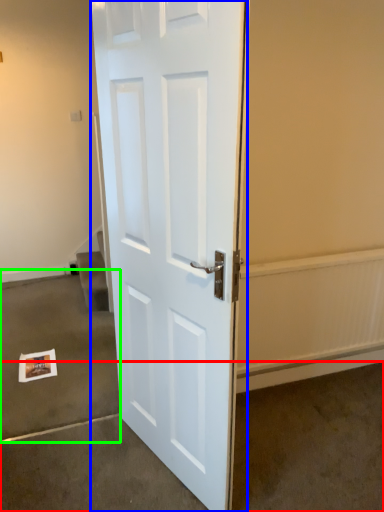
Question: Which object is the farthest from concrete (highlighted by a red box)? Choose among these: door (highlighted by a blue box) or concrete (highlighted by a green box).

Choices:
 (A) door
 (B) concrete

Answer: (B)